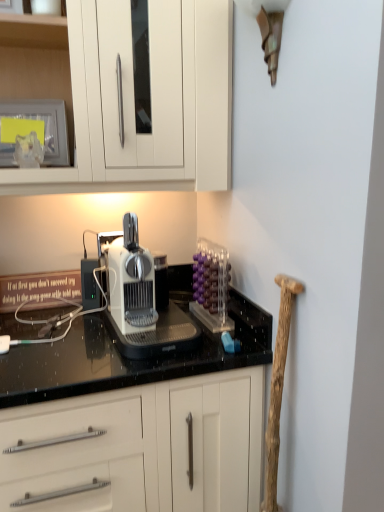
Question: Should I look upward or downward to see wooden at right?

Choices:
 (A) down
 (B) up

Answer: (A)

Question: From a real-world perspective, is matte glass frame at upper left physically below white plastic coffee machine at center?

Choices:
 (A) yes
 (B) no

Answer: (B)

Question: Does matte glass frame at upper left turn towards white plastic coffee machine at center?

Choices:
 (A) no
 (B) yes

Answer: (A)

Question: Can you confirm if matte glass frame at upper left is positioned to the left of white plastic coffee machine at center?

Choices:
 (A) yes
 (B) no

Answer: (A)

Question: Can you confirm if matte glass frame at upper left is thinner than white plastic coffee machine at center?

Choices:
 (A) no
 (B) yes

Answer: (B)

Question: From the image's perspective, would you say matte glass frame at upper left is shown under white plastic coffee machine at center?

Choices:
 (A) yes
 (B) no

Answer: (B)

Question: Is matte glass frame at upper left oriented away from white plastic coffee machine at center?

Choices:
 (A) yes
 (B) no

Answer: (B)

Question: From a real-world perspective, does wooden at right sit lower than transparent acrylic container at upper right?

Choices:
 (A) no
 (B) yes

Answer: (B)

Question: Is wooden at right to the left of transparent acrylic container at upper right from the viewer's perspective?

Choices:
 (A) no
 (B) yes

Answer: (A)

Question: Is wooden at right not close to transparent acrylic container at upper right?

Choices:
 (A) yes
 (B) no

Answer: (B)

Question: Are wooden at right and transparent acrylic container at upper right making contact?

Choices:
 (A) yes
 (B) no

Answer: (B)

Question: From a real-world perspective, is wooden at right over transparent acrylic container at upper right?

Choices:
 (A) no
 (B) yes

Answer: (A)

Question: Is wooden at right positioned beyond the bounds of transparent acrylic container at upper right?

Choices:
 (A) yes
 (B) no

Answer: (A)

Question: Could wooden at right be considered to be inside white plastic coffee machine at center?

Choices:
 (A) yes
 (B) no

Answer: (B)